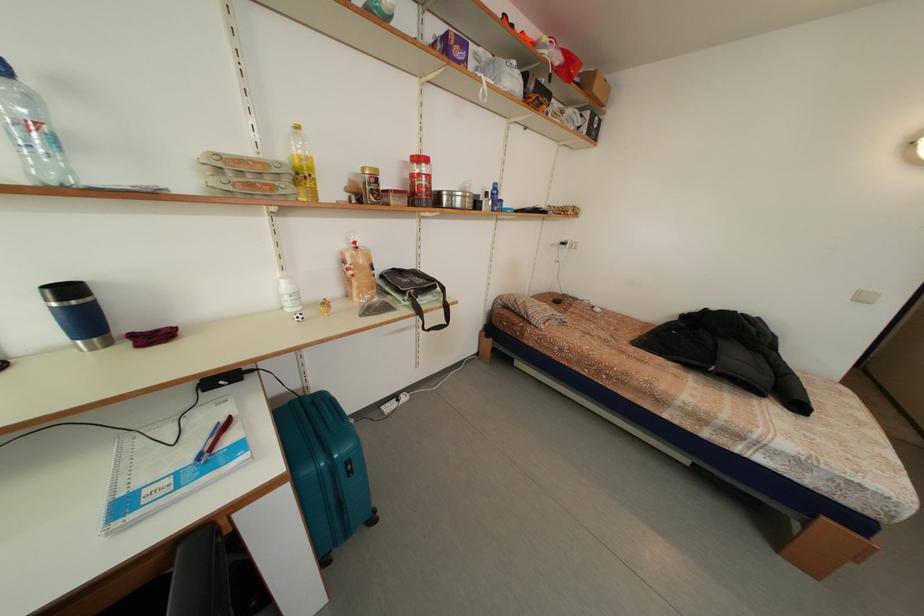
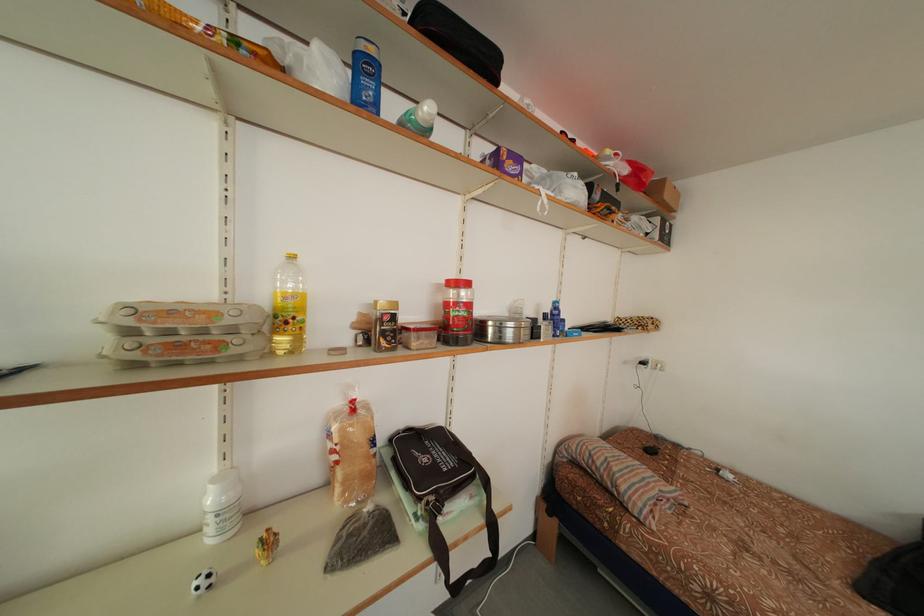
In the second image, find the point that corresponds to [249,166] in the first image.

(178, 317)